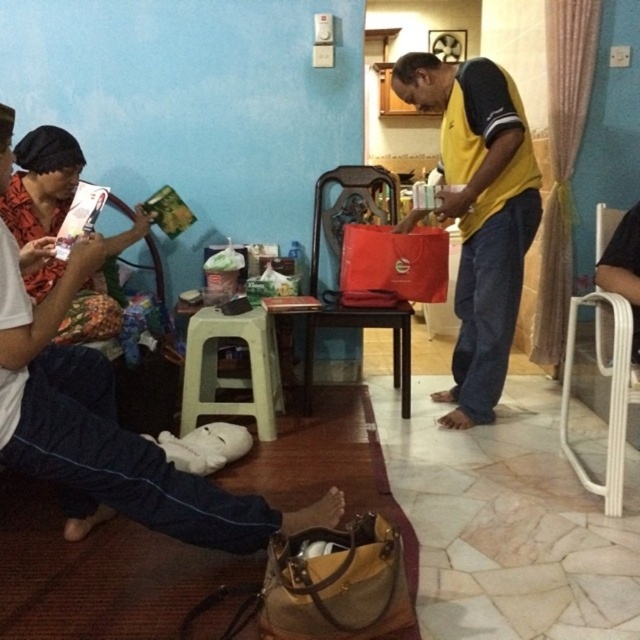
You are a guest in this living room and want to sit down. You see the white plastic chair at lower right and the dark brown wooden chair at center. Which chair is located to the right of the other?

The white plastic chair at lower right is to the right of the dark brown wooden chair at center.

Based on the photo, you are a guest entering the room and want to sit down. You see the white plastic chair at lower right and the plastic stool at center. Which one is closer to the entrance?

The white plastic chair at lower right is in front of the plastic stool at center, so it is closer to the entrance.

You are standing in the living room and want to place a small plant pot between the plastic stool at center and the dark brown wooden chair at center. Which object should you place the pot closer to if you want it to appear larger in your photo?

To make the plant pot appear larger in the photo, place it closer to the plastic stool at center since it is nearer to the viewer compared to the dark brown wooden chair at center.